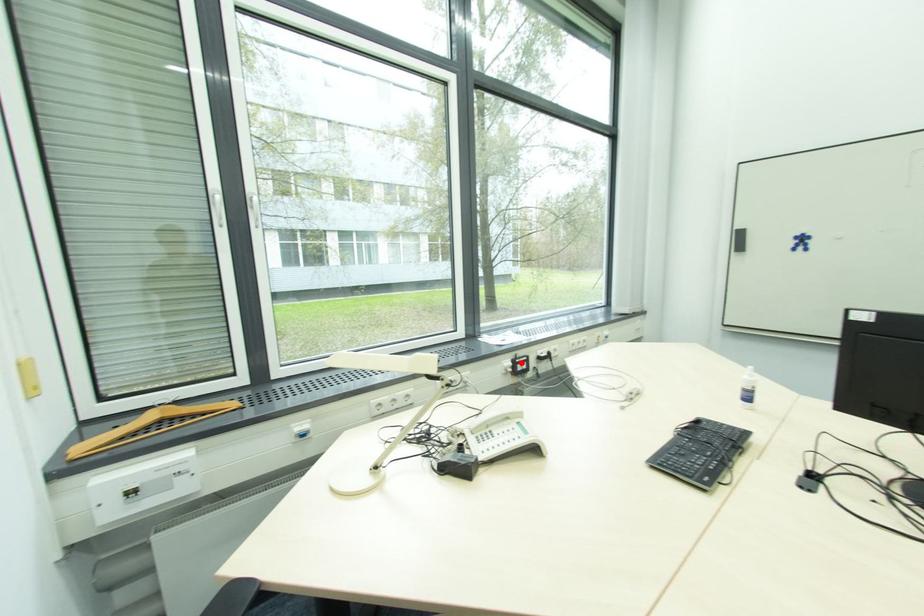
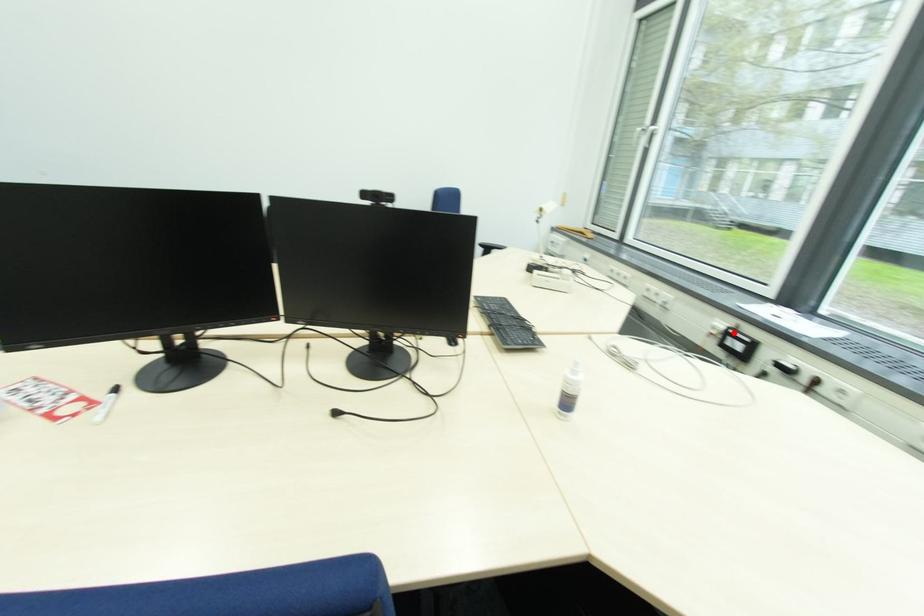
I am providing you with two images of the same scene from different viewpoints. A red point is marked on the first image and another point is marked on the second image. Does the point marked in image1 correspond to the same location as the one in image2?

Yes